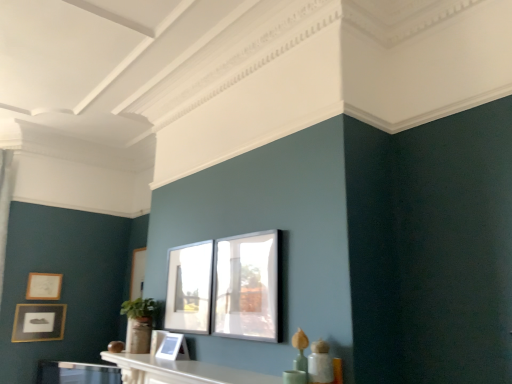
Question: Is clear glass window at center shorter than matte white picture frame at center, the 3th picture frame when ordered from left to right?

Choices:
 (A) yes
 (B) no

Answer: (B)

Question: Could you tell me if clear glass window at center is turned towards matte white picture frame at center, arranged as the third picture frame when viewed from the back?

Choices:
 (A) no
 (B) yes

Answer: (A)

Question: Is clear glass window at center smaller than matte white picture frame at center, which is the 2th picture frame from right to left?

Choices:
 (A) yes
 (B) no

Answer: (B)

Question: Does clear glass window at center have a larger size compared to matte white picture frame at center, the 3th picture frame when ordered from left to right?

Choices:
 (A) yes
 (B) no

Answer: (A)

Question: Is clear glass window at center positioned in front of matte white picture frame at center, which ranks as the second picture frame in front-to-back order?

Choices:
 (A) no
 (B) yes

Answer: (B)

Question: From the image's perspective, is clear glass window at center under matte white picture frame at center, arranged as the third picture frame when viewed from the back?

Choices:
 (A) no
 (B) yes

Answer: (A)

Question: Considering the relative positions of matte glass picture frame at center, which appears as the 1th picture frame when viewed from the right, and matte gold picture frame at lower left, which is counted as the second picture frame, starting from the back, in the image provided, is matte glass picture frame at center, which appears as the 1th picture frame when viewed from the right, to the left of matte gold picture frame at lower left, which is counted as the second picture frame, starting from the back, from the viewer's perspective?

Choices:
 (A) yes
 (B) no

Answer: (B)

Question: From the image's perspective, is matte glass picture frame at center, placed as the fourth picture frame when sorted from left to right, under matte gold picture frame at lower left, which ranks as the 1th picture frame in left-to-right order?

Choices:
 (A) yes
 (B) no

Answer: (B)

Question: Does matte glass picture frame at center, which appears as the 1th picture frame when viewed from the right, appear on the right side of matte gold picture frame at lower left, which ranks as the 1th picture frame in left-to-right order?

Choices:
 (A) yes
 (B) no

Answer: (A)

Question: Does matte glass picture frame at center, which appears as the 1th picture frame when viewed from the right, turn towards matte gold picture frame at lower left, which is counted as the 3th picture frame, starting from the front?

Choices:
 (A) no
 (B) yes

Answer: (A)

Question: Is matte glass picture frame at center, which is the fourth picture frame in back-to-front order, thinner than matte gold picture frame at lower left, which is counted as the second picture frame, starting from the back?

Choices:
 (A) yes
 (B) no

Answer: (B)

Question: Is matte glass picture frame at center, which is the fourth picture frame in back-to-front order, surrounding matte gold picture frame at lower left, which is the fourth picture frame from right to left?

Choices:
 (A) yes
 (B) no

Answer: (B)

Question: Considering the relative sizes of matte gold picture frame at lower left, which is counted as the 3th picture frame, starting from the front, and clear glass window at center in the image provided, is matte gold picture frame at lower left, which is counted as the 3th picture frame, starting from the front, shorter than clear glass window at center?

Choices:
 (A) yes
 (B) no

Answer: (A)